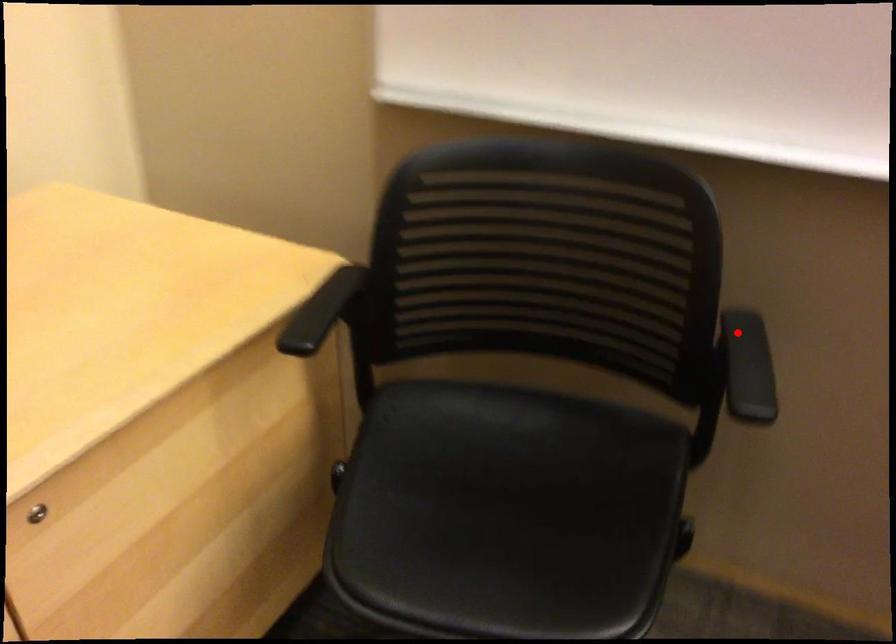
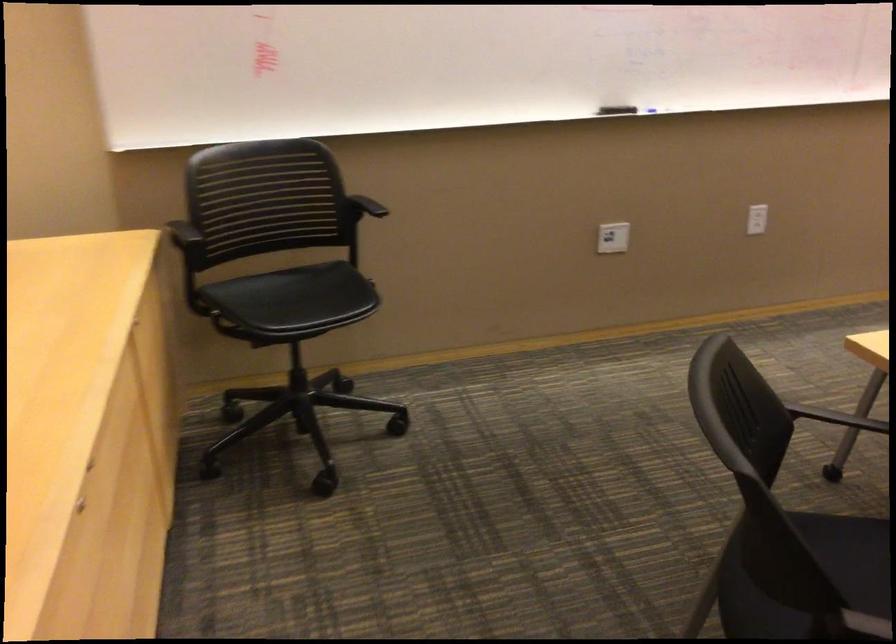
Question: I am providing you with two images of the same scene from different viewpoints. A red point is shown in image1. For the corresponding object point in image2, is it positioned nearer or farther from the camera?

Choices:
 (A) Nearer
 (B) Farther

Answer: (B)